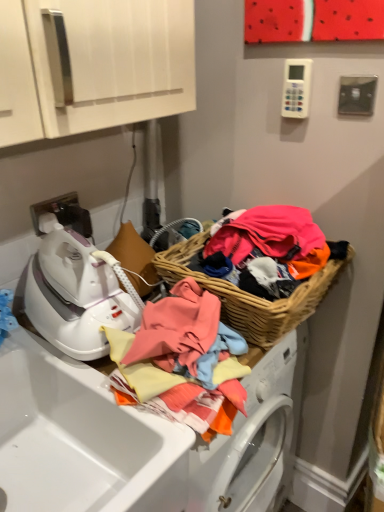
Find the location of `woven wood basket at right`. woven wood basket at right is located at coordinates (252, 295).

This screenshot has width=384, height=512. I want to click on woven wood basket at right, so click(x=252, y=295).

Between woven wood basket at right and white glossy sink at lower left, which one appears on the left side from the viewer's perspective?

white glossy sink at lower left.

Can you confirm if woven wood basket at right is wider than white glossy sink at lower left?

No.

Is white glossy sink at lower left at the back of woven wood basket at right?

woven wood basket at right is not turned away from white glossy sink at lower left.

Is woven wood basket at right beside white glossy sink at lower left?

They are not placed beside each other.

Does point (177, 245) appear closer or farther from the camera than point (45, 293)?

Point (177, 245) is positioned farther from the camera compared to point (45, 293).

Is woven wood basket at right looking in the opposite direction of white glossy iron at left?

woven wood basket at right does not have its back to white glossy iron at left.

Does woven wood basket at right lie in front of white glossy iron at left?

No, it is not.

Does white glossy sink at lower left have a greater width compared to woven wood basket at right?

Indeed, white glossy sink at lower left has a greater width compared to woven wood basket at right.

Which of these two, white glossy sink at lower left or woven wood basket at right, is smaller?

Smaller between the two is woven wood basket at right.

Find the location of a particular element. Image resolution: width=384 pixels, height=512 pixels. sink in front of the woven wood basket at right is located at coordinates (81, 439).

Does point (3, 451) come closer to viewer compared to point (314, 275)?

No, (3, 451) is further to viewer.

Is white glossy iron at left in front of or behind white glossy sink at lower left in the image?

white glossy iron at left is behind white glossy sink at lower left.

Is white glossy iron at left turned away from white glossy sink at lower left?

No.

From a real-world perspective, is white glossy iron at left below white glossy sink at lower left?

No, from a real-world perspective, white glossy iron at left is not under white glossy sink at lower left.

Is white glossy iron at left next to white glossy sink at lower left and touching it?

No, white glossy iron at left is not touching white glossy sink at lower left.

Based on the photo, is white glossy iron at left surrounding woven wood basket at right?

No, white glossy iron at left does not contain woven wood basket at right.

Does white glossy iron at left have a larger size compared to woven wood basket at right?

No.

Considering the points (96, 288) and (247, 339), which point is behind, point (96, 288) or point (247, 339)?

Positioned behind is point (247, 339).

In the image, is white glossy iron at left on the left side or the right side of woven wood basket at right?

Based on their positions, white glossy iron at left is located to the left of woven wood basket at right.

In the scene shown: Would you say white glossy sink at lower left contains white glossy iron at left?

No, white glossy iron at left is located outside of white glossy sink at lower left.

Is white glossy sink at lower left at the left side of white glossy iron at left?

Correct, you'll find white glossy sink at lower left to the left of white glossy iron at left.

Are white glossy sink at lower left and white glossy iron at left making contact?

No, white glossy sink at lower left is not making contact with white glossy iron at left.

Find the location of a particular element. This screenshot has width=384, height=512. picnic basket located above the white glossy sink at lower left (from the image's perspective) is located at coordinates (252, 295).

In the image, there is a woven wood basket at right. Find the location of `washer below it (from the image's perspective)`. washer below it (from the image's perspective) is located at coordinates (75, 293).

From the image, which object appears to be farther from white glossy iron at left, woven wood basket at right or white glossy sink at lower left?

woven wood basket at right.

Estimate the real-world distances between objects in this image. Which object is closer to white glossy sink at lower left, woven wood basket at right or white glossy iron at left?

white glossy iron at left is closer to white glossy sink at lower left.

From the image, which object appears to be farther from white glossy iron at left, white glossy sink at lower left or woven wood basket at right?

The object further to white glossy iron at left is woven wood basket at right.

From the picture: Estimate the real-world distances between objects in this image. Which object is further from woven wood basket at right, white glossy iron at left or white glossy sink at lower left?

white glossy sink at lower left is positioned further to the anchor woven wood basket at right.

From the image, which object appears to be farther from woven wood basket at right, white glossy sink at lower left or white glossy iron at left?

white glossy sink at lower left lies further to woven wood basket at right than the other object.

Consider the image. Based on their spatial positions, is white glossy iron at left or woven wood basket at right further from white glossy sink at lower left?

Among the two, woven wood basket at right is located further to white glossy sink at lower left.

Where is `washer situated between white glossy sink at lower left and woven wood basket at right from left to right`? The height and width of the screenshot is (512, 384). washer situated between white glossy sink at lower left and woven wood basket at right from left to right is located at coordinates click(x=75, y=293).